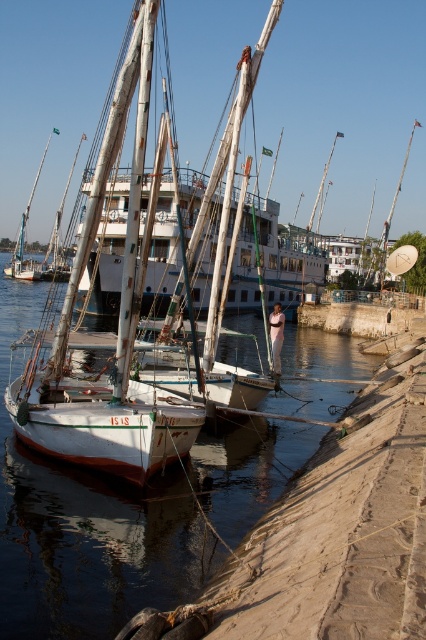
Is white matte water at lower left thinner than white wood mast at upper center?

In fact, white matte water at lower left might be wider than white wood mast at upper center.

Can you confirm if white matte water at lower left is smaller than white wood mast at upper center?

Yes, white matte water at lower left is smaller than white wood mast at upper center.

Image resolution: width=426 pixels, height=640 pixels. Describe the element at coordinates (86, 528) in the screenshot. I see `white matte water at lower left` at that location.

The height and width of the screenshot is (640, 426). I want to click on white matte water at lower left, so click(x=86, y=528).

Looking at this image, who is more forward, [25,310] or [391,212]?

Positioned in front is point [25,310].

Can you confirm if white matte water at lower left is bigger than white matte mast at upper right?

Actually, white matte water at lower left might be smaller than white matte mast at upper right.

At what (x,y) coordinates should I click in order to perform the action: click on white matte water at lower left. Please return your answer as a coordinate pair (x, y). The height and width of the screenshot is (640, 426). Looking at the image, I should click on (86, 528).

Is white matte sailboat at center shorter than white matte mast at upper right?

Correct, white matte sailboat at center is not as tall as white matte mast at upper right.

Which is in front, point (69, 451) or point (383, 240)?

Point (69, 451) is in front.

Between point (17, 420) and point (419, 122), which one is positioned behind?

The point (419, 122) is more distant.

Where is `white matte sailboat at center`? white matte sailboat at center is located at coordinates (118, 330).